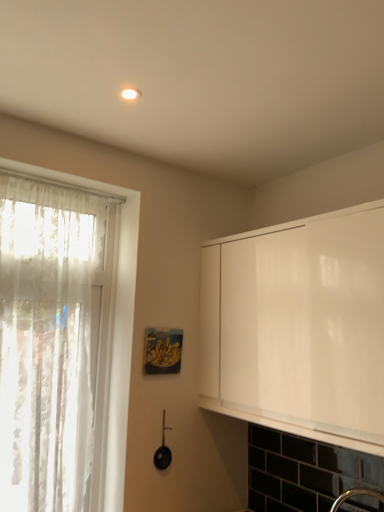
Question: Based on their positions, is white lace curtain at left located to the left or right of white matte cabinet at right?

Choices:
 (A) right
 (B) left

Answer: (B)

Question: In terms of size, does white lace curtain at left appear bigger or smaller than white matte cabinet at right?

Choices:
 (A) big
 (B) small

Answer: (B)

Question: Which object is the closest to the white matte cabinet at right?

Choices:
 (A) matte wooden picture frame at center
 (B) white lace curtain at left

Answer: (A)

Question: Considering the real-world distances, which object is closest to the white lace curtain at left?

Choices:
 (A) white matte cabinet at right
 (B) matte wooden picture frame at center

Answer: (B)